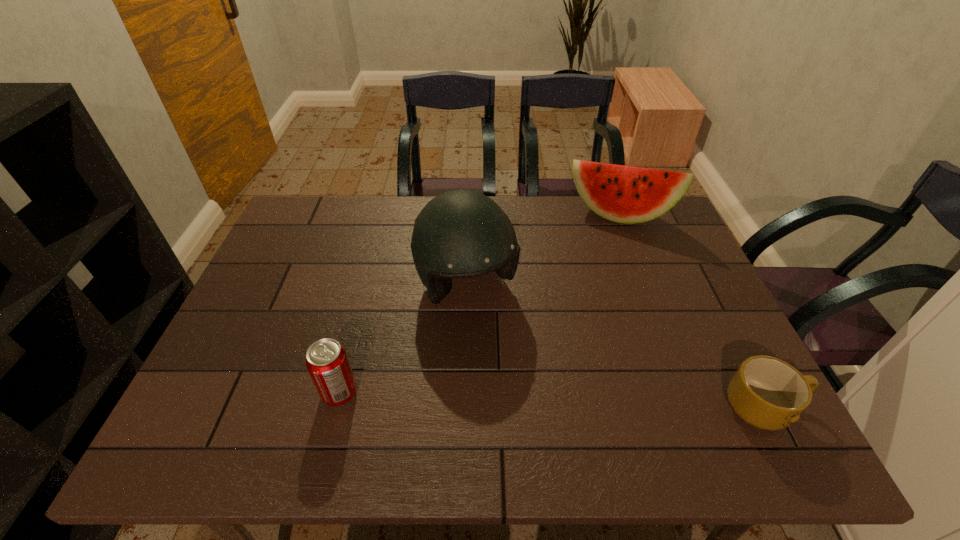
Locate an element on the screen. The image size is (960, 540). soda is located at coordinates (326, 360).

What are the coordinates of `the third tallest object` in the screenshot? It's located at (326, 360).

In order to click on the shortest object in this screenshot , I will do `click(768, 393)`.

I want to click on the third object from right to left, so click(459, 234).

Identify the location of the tallest object. (459, 234).

Identify the location of the farthest object. (624, 194).

Find the location of a particular element. The image size is (960, 540). the second tallest object is located at coordinates (624, 194).

Image resolution: width=960 pixels, height=540 pixels. I want to click on vacant space situated on the right of the leftmost object, so (461, 393).

I want to click on vacant space positioned at the face opening of the tallest object, so click(x=524, y=381).

The image size is (960, 540). In order to click on vacant area located at the face opening of the tallest object in this screenshot , I will do pyautogui.click(x=506, y=352).